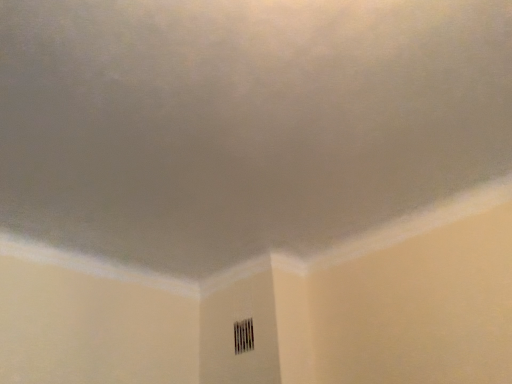
In order to face black textured vent at lower center, should I rotate leftwards or rightwards?

To align with it, rotate left about 1.500°.

What do you see at coordinates (243, 336) in the screenshot?
I see `black textured vent at lower center` at bounding box center [243, 336].

Image resolution: width=512 pixels, height=384 pixels. Find the location of `black textured vent at lower center`. black textured vent at lower center is located at coordinates (243, 336).

The height and width of the screenshot is (384, 512). What are the coordinates of `black textured vent at lower center` in the screenshot? It's located at (243, 336).